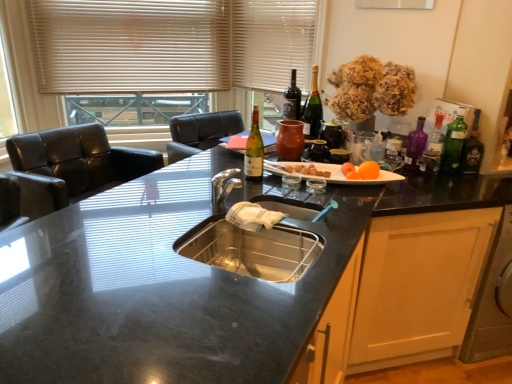
Question: Is white fabric curtain at upper center surrounded by matte glass wine bottle at center, which is the 4th bottle in right-to-left order?

Choices:
 (A) no
 (B) yes

Answer: (A)

Question: Can you confirm if matte glass wine bottle at center, which appears as the second bottle when viewed from the left, is positioned to the left of white fabric curtain at upper center?

Choices:
 (A) no
 (B) yes

Answer: (A)

Question: Can you confirm if matte glass wine bottle at center, positioned as the 1th bottle in back-to-front order, is smaller than white fabric curtain at upper center?

Choices:
 (A) yes
 (B) no

Answer: (A)

Question: From the image's perspective, is matte glass wine bottle at center, which is the 4th bottle in right-to-left order, on top of white fabric curtain at upper center?

Choices:
 (A) yes
 (B) no

Answer: (B)

Question: Is the surface of matte glass wine bottle at center, which appears as the second bottle when viewed from the left, in direct contact with white fabric curtain at upper center?

Choices:
 (A) yes
 (B) no

Answer: (B)

Question: Does matte glass wine bottle at center, positioned as the 1th bottle in back-to-front order, come behind white fabric curtain at upper center?

Choices:
 (A) no
 (B) yes

Answer: (A)

Question: Is green glass bottle at right, the 5th bottle viewed from the left, completely or partially outside of green glass bottle at right, placed as the second bottle when sorted from front to back?

Choices:
 (A) no
 (B) yes

Answer: (B)

Question: Is there a large distance between green glass bottle at right, which ranks as the 2th bottle in back-to-front order, and green glass bottle at right, the fourth bottle from the left?

Choices:
 (A) no
 (B) yes

Answer: (A)

Question: Is green glass bottle at right, marked as the 4th bottle in a front-to-back arrangement, beside green glass bottle at right, placed as the second bottle when sorted from front to back?

Choices:
 (A) yes
 (B) no

Answer: (A)

Question: From a real-world perspective, is green glass bottle at right, which is the 1th bottle in right-to-left order, beneath green glass bottle at right, the 2th bottle positioned from the right?

Choices:
 (A) no
 (B) yes

Answer: (B)

Question: Is green glass bottle at right, acting as the fourth bottle starting from the back, completely or partially inside green glass bottle at right, the 5th bottle viewed from the left?

Choices:
 (A) yes
 (B) no

Answer: (B)

Question: From the image's perspective, is green glass bottle at right, marked as the 4th bottle in a front-to-back arrangement, above green glass bottle at right, the 2th bottle positioned from the right?

Choices:
 (A) yes
 (B) no

Answer: (B)

Question: Can you confirm if black granite countertop at center is smaller than matte glass wine bottle at upper right?

Choices:
 (A) yes
 (B) no

Answer: (B)